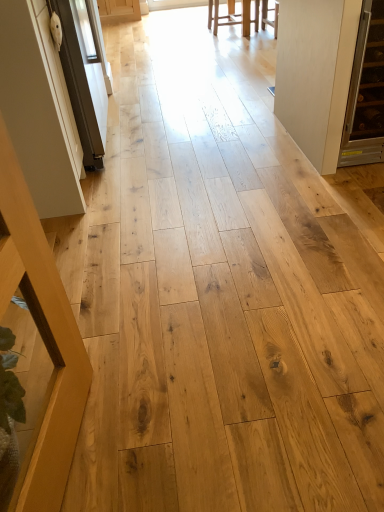
Identify the location of free space that is to the left of white matte door at right. The height and width of the screenshot is (512, 384). (203, 151).